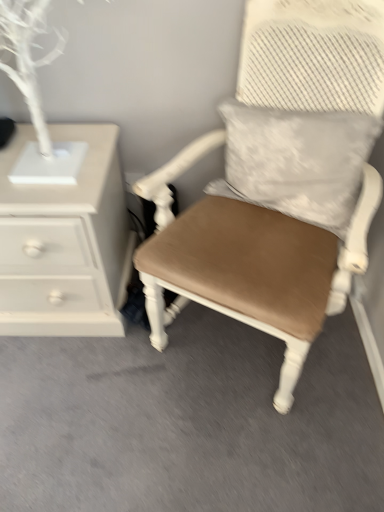
Question: Is the depth of matte brown cushioned chair at center greater than that of white textured pillow at upper right?

Choices:
 (A) yes
 (B) no

Answer: (B)

Question: Can you confirm if matte brown cushioned chair at center is wider than white textured pillow at upper right?

Choices:
 (A) no
 (B) yes

Answer: (B)

Question: Is white textured pillow at upper right at the back of matte brown cushioned chair at center?

Choices:
 (A) yes
 (B) no

Answer: (A)

Question: From a real-world perspective, is matte brown cushioned chair at center located higher than white textured pillow at upper right?

Choices:
 (A) yes
 (B) no

Answer: (B)

Question: From the image's perspective, is matte brown cushioned chair at center beneath white textured pillow at upper right?

Choices:
 (A) yes
 (B) no

Answer: (A)

Question: Considering the relative sizes of matte brown cushioned chair at center and white textured pillow at upper right in the image provided, is matte brown cushioned chair at center bigger than white textured pillow at upper right?

Choices:
 (A) no
 (B) yes

Answer: (B)

Question: From the image's perspective, is white textured pillow at upper right under white painted wood chest of drawers at left?

Choices:
 (A) yes
 (B) no

Answer: (B)

Question: Is white textured pillow at upper right behind white painted wood chest of drawers at left?

Choices:
 (A) yes
 (B) no

Answer: (B)

Question: Considering the relative sizes of white textured pillow at upper right and white painted wood chest of drawers at left in the image provided, is white textured pillow at upper right wider than white painted wood chest of drawers at left?

Choices:
 (A) yes
 (B) no

Answer: (B)

Question: Can you confirm if white textured pillow at upper right is shorter than white painted wood chest of drawers at left?

Choices:
 (A) yes
 (B) no

Answer: (A)

Question: Could you tell me if white textured pillow at upper right is turned towards white painted wood chest of drawers at left?

Choices:
 (A) yes
 (B) no

Answer: (B)

Question: Considering the relative sizes of white textured pillow at upper right and white painted wood chest of drawers at left in the image provided, is white textured pillow at upper right thinner than white painted wood chest of drawers at left?

Choices:
 (A) yes
 (B) no

Answer: (A)

Question: Is matte brown cushioned chair at center far away from white painted wood chest of drawers at left?

Choices:
 (A) yes
 (B) no

Answer: (B)